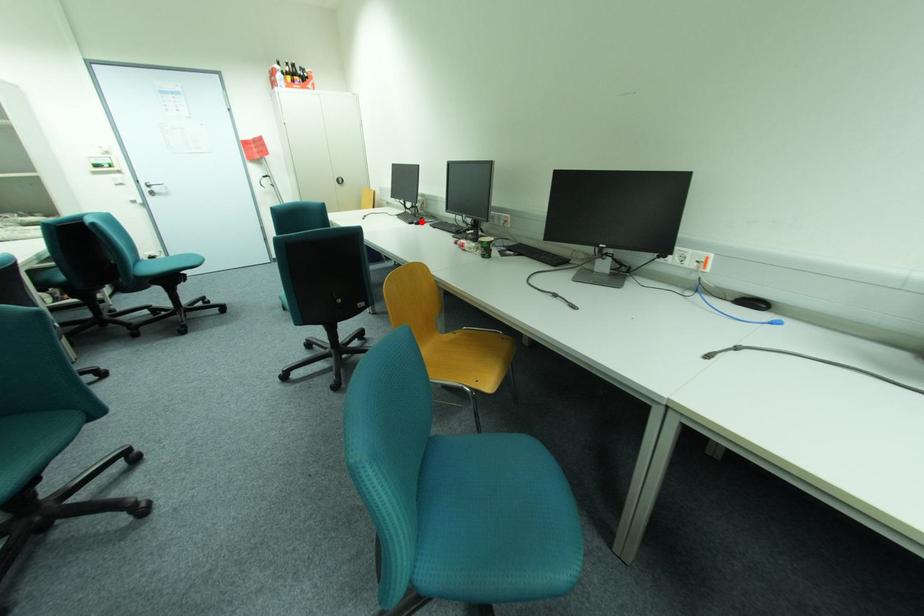
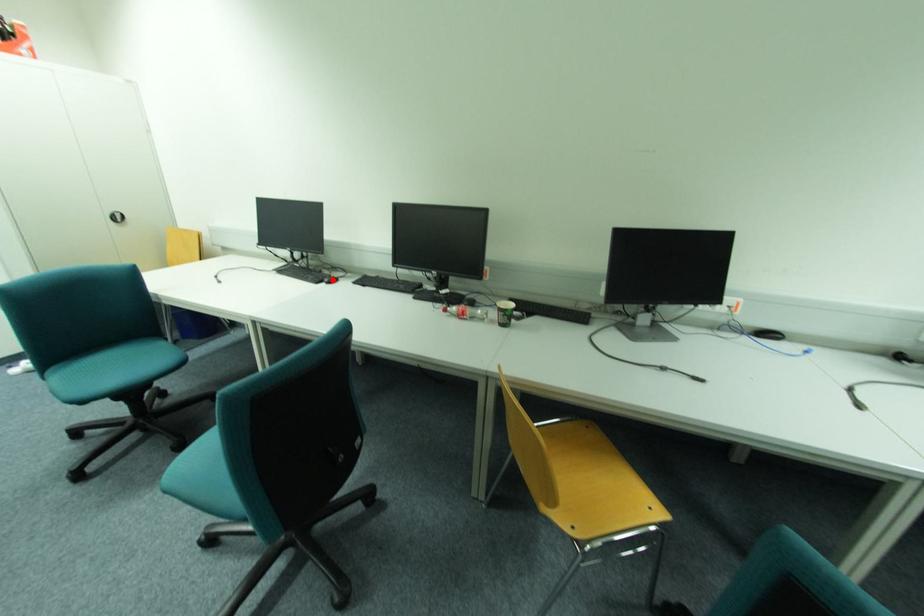
I am providing you with two images of the same scene from different viewpoints. A red point is marked on the first image and another point is marked on the second image. Do the highlighted points in image1 and image2 indicate the same real-world spot?

Yes